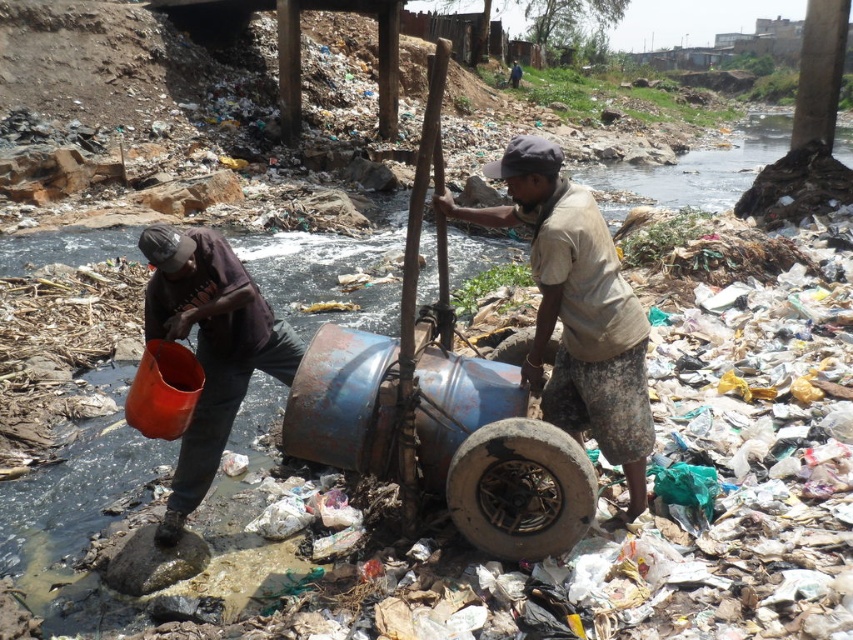
You are a waste management worker who needs to move the matte orange bucket at left and the charred rubber tire at lower center to a disposal area. Given their positions, which object should you move first to avoid blocking the path to the other?

The matte orange bucket at left should be moved first because it is positioned on the left side of the charred rubber tire at lower center, so moving it first would prevent blocking the path to the tire.

You are a photographer standing in the scene and want to take a photo that includes both the matte orange bucket at left and the charred rubber tire at lower center. Which object should you adjust your camera focus to first to ensure both are in the frame?

The matte orange bucket at left is closer to you than the charred rubber tire at lower center, so you should focus on the matte orange bucket at left first to ensure both are in the frame.